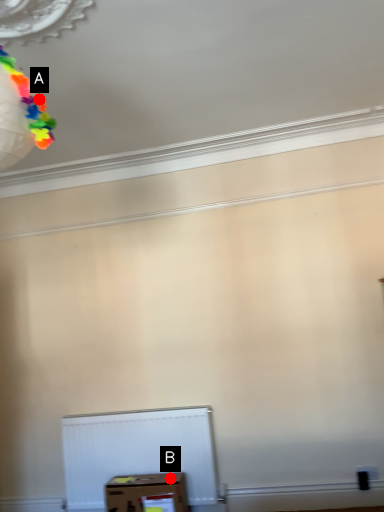
Question: Two points are circled on the image, labeled by A and B beside each circle. Among these points, which one is farthest from the camera?

Choices:
 (A) A is further
 (B) B is further

Answer: (B)